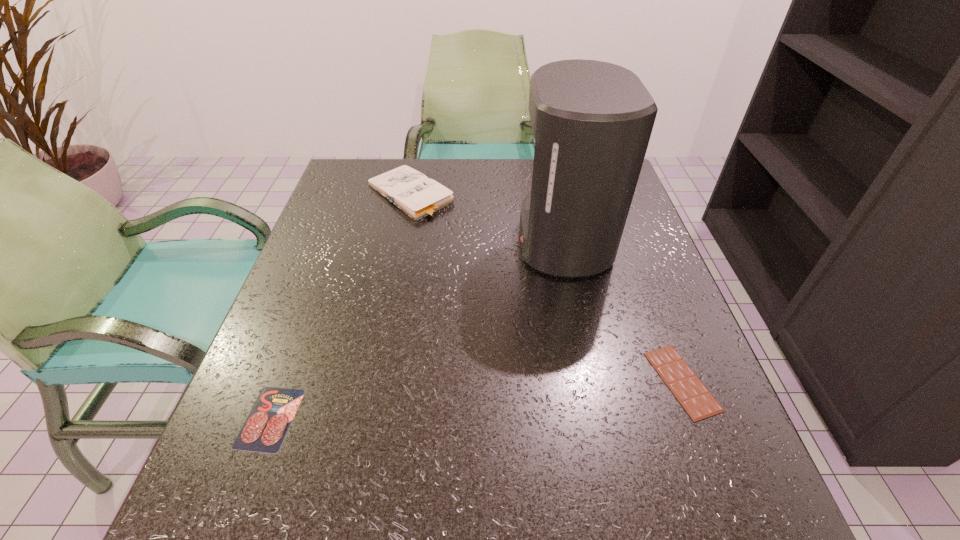
The width and height of the screenshot is (960, 540). I want to click on free space between the salami and the chocolate bar, so click(476, 400).

This screenshot has width=960, height=540. I want to click on free space between the salami and the notebook, so click(340, 306).

The image size is (960, 540). I want to click on unoccupied position between the chocolate bar and the tallest object, so 622,310.

Identify the location of empty space between the chocolate bar and the salami. Image resolution: width=960 pixels, height=540 pixels. (476, 400).

The image size is (960, 540). I want to click on object that stands as the third closest to the salami, so click(698, 402).

I want to click on object that is the third closest to the salami, so click(x=698, y=402).

Identify the location of vacant region that satisfies the following two spatial constraints: 1. on the back side of the chocolate bar; 2. on the button side of the coffee maker. Image resolution: width=960 pixels, height=540 pixels. (628, 239).

Where is `vacant space that satisfies the following two spatial constraints: 1. on the button side of the coffee maker; 2. on the left side of the chocolate bar`? vacant space that satisfies the following two spatial constraints: 1. on the button side of the coffee maker; 2. on the left side of the chocolate bar is located at coordinates (593, 381).

Locate an element on the screen. free space that satisfies the following two spatial constraints: 1. on the button side of the tallest object; 2. on the right side of the chocolate bar is located at coordinates (593, 381).